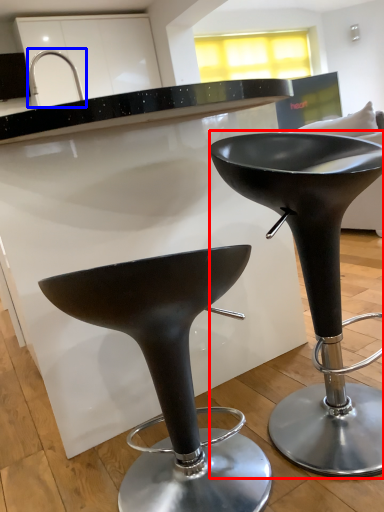
Question: Which object appears farthest to the camera in this image, stool (highlighted by a red box) or faucet (highlighted by a blue box)?

Choices:
 (A) stool
 (B) faucet

Answer: (B)